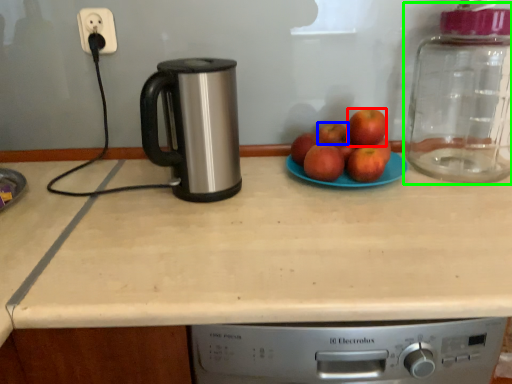
Question: Which is farther away from apple (highlighted by a red box)? apple (highlighted by a blue box) or glass jar (highlighted by a green box)?

Choices:
 (A) apple
 (B) glass jar

Answer: (B)